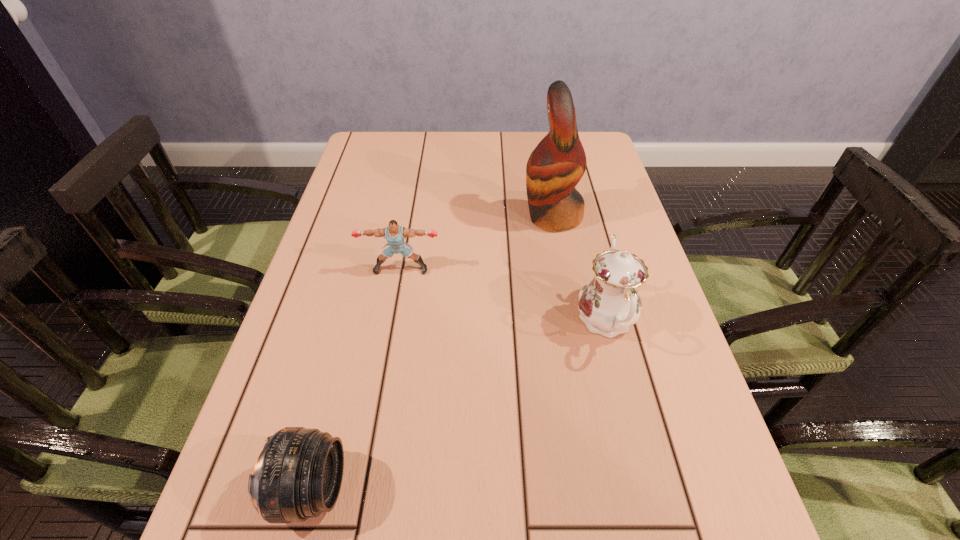
I want to click on the farthest object, so click(557, 164).

Where is `the tallest object`? the tallest object is located at coordinates (557, 164).

Find the location of a particular element. chinaware is located at coordinates (609, 304).

Where is `the third farthest object`? Image resolution: width=960 pixels, height=540 pixels. the third farthest object is located at coordinates (609, 304).

Locate an element on the screen. This screenshot has height=540, width=960. the second farthest object is located at coordinates (395, 234).

Where is `telephoto lens`? This screenshot has width=960, height=540. telephoto lens is located at coordinates (298, 475).

Identify the location of free point located 0.060m on the face of the tallest object. (499, 217).

At what (x,y) coordinates should I click in order to perform the action: click on free space located 0.350m on the face of the tallest object. Please return your answer as a coordinate pair (x, y). The width and height of the screenshot is (960, 540). Looking at the image, I should click on coord(391,217).

Identify the location of vacant area located on the face of the tallest object. (469, 217).

This screenshot has height=540, width=960. I want to click on vacant area situated on the left of the second tallest object, so click(x=458, y=321).